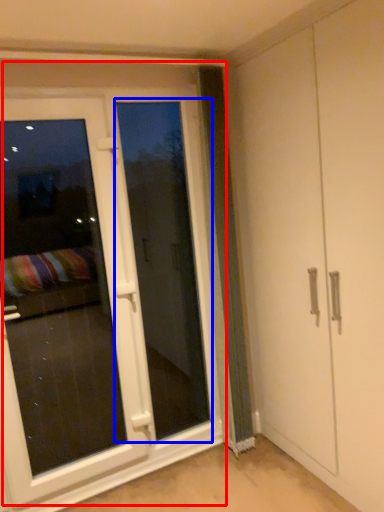
Question: Which point is closer to the camera, door (highlighted by a red box) or screen door (highlighted by a blue box)?

Choices:
 (A) door
 (B) screen door

Answer: (A)